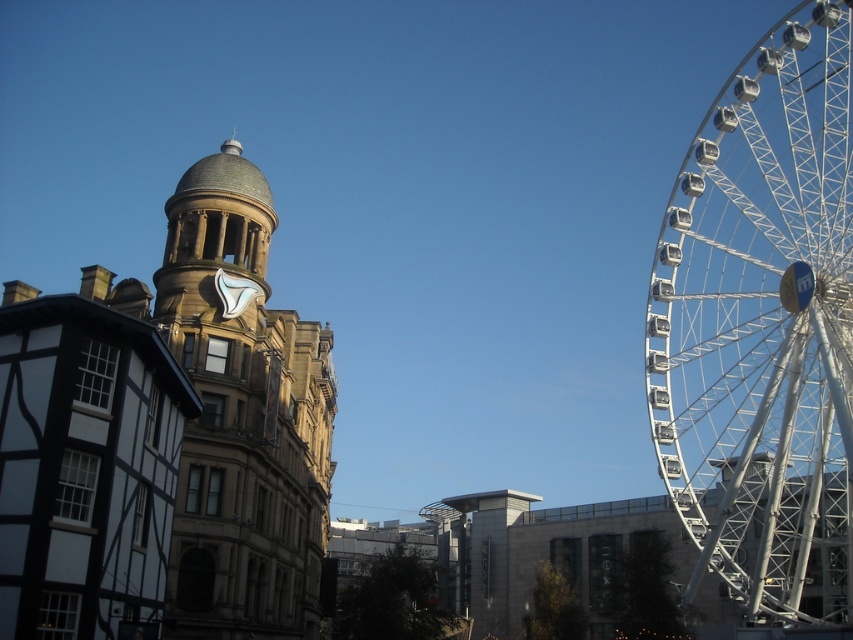
Between white metallic ferris wheel at right and brown stone clock tower at center, which one has more height?

Standing taller between the two is white metallic ferris wheel at right.

Between point (730, 371) and point (212, 237), which one is positioned behind?

Positioned behind is point (730, 371).

At what (x,y) coordinates should I click in order to perform the action: click on white metallic ferris wheel at right. Please return your answer as a coordinate pair (x, y). This screenshot has height=640, width=853. Looking at the image, I should click on (763, 326).